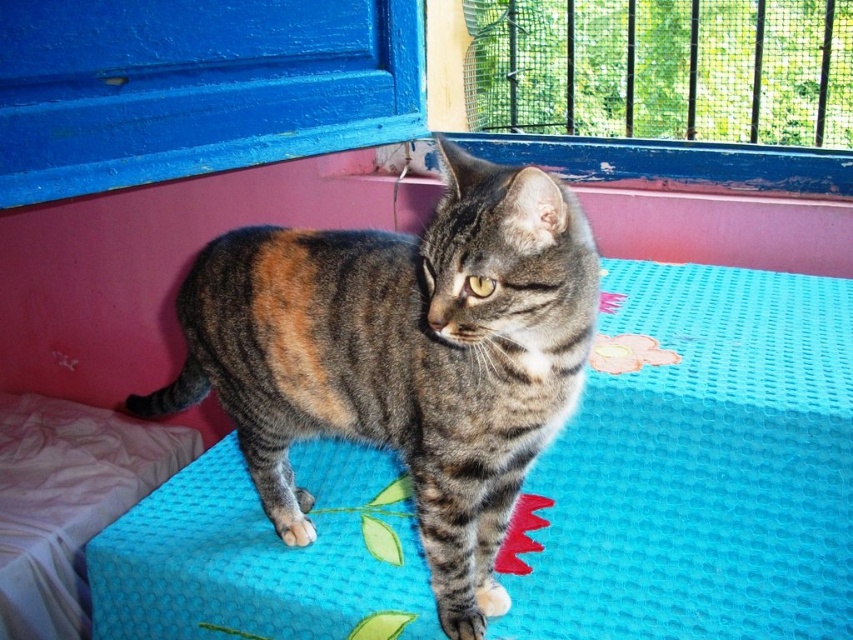
Question: Is tabby fur cat at center to the left of pink fabric at lower left from the viewer's perspective?

Choices:
 (A) no
 (B) yes

Answer: (A)

Question: Which of the following is the closest to the observer?

Choices:
 (A) (161, 460)
 (B) (527, 180)

Answer: (B)

Question: Which of the following is the farthest from the observer?

Choices:
 (A) (259, 337)
 (B) (62, 548)

Answer: (B)

Question: Is tabby fur cat at center bigger than pink fabric at lower left?

Choices:
 (A) yes
 (B) no

Answer: (B)

Question: Observing the image, what is the correct spatial positioning of tabby fur cat at center in reference to pink fabric at lower left?

Choices:
 (A) above
 (B) below

Answer: (A)